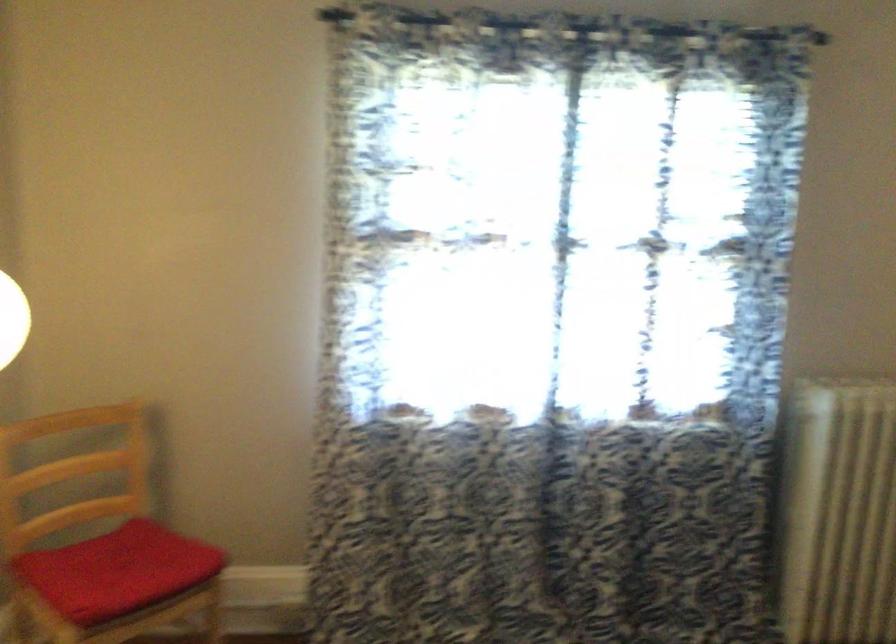
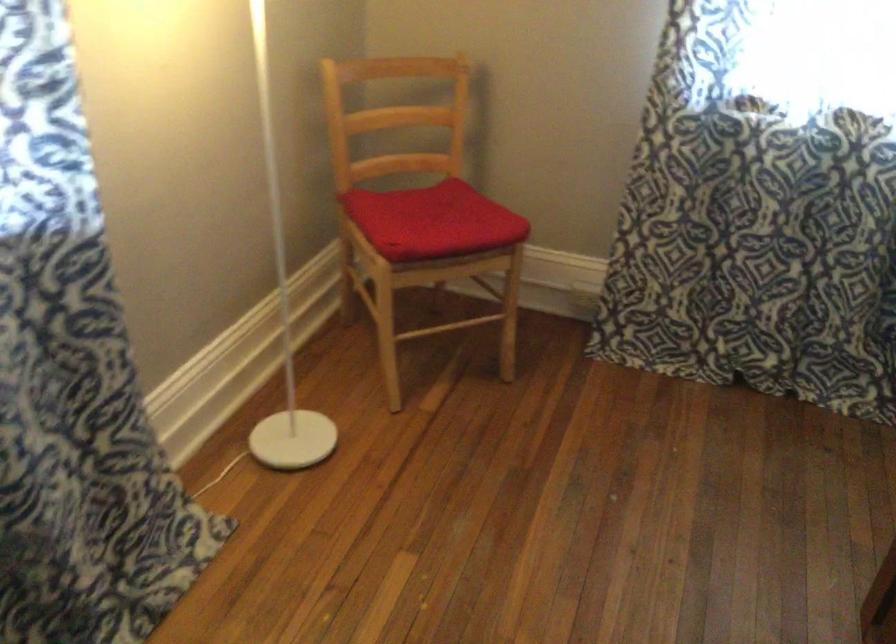
Based on the continuous images, in which direction is the camera rotating?

The rotation direction of the camera is left-down.